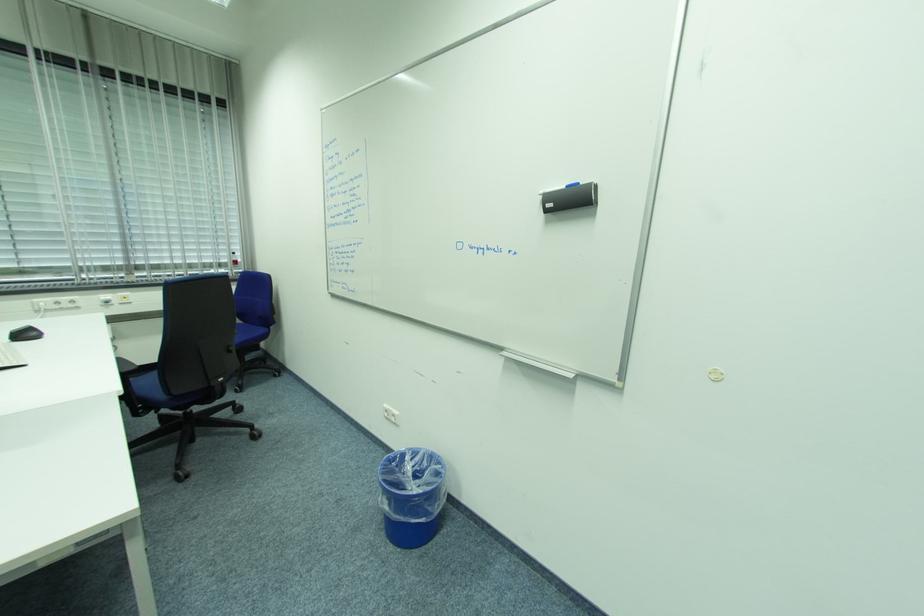
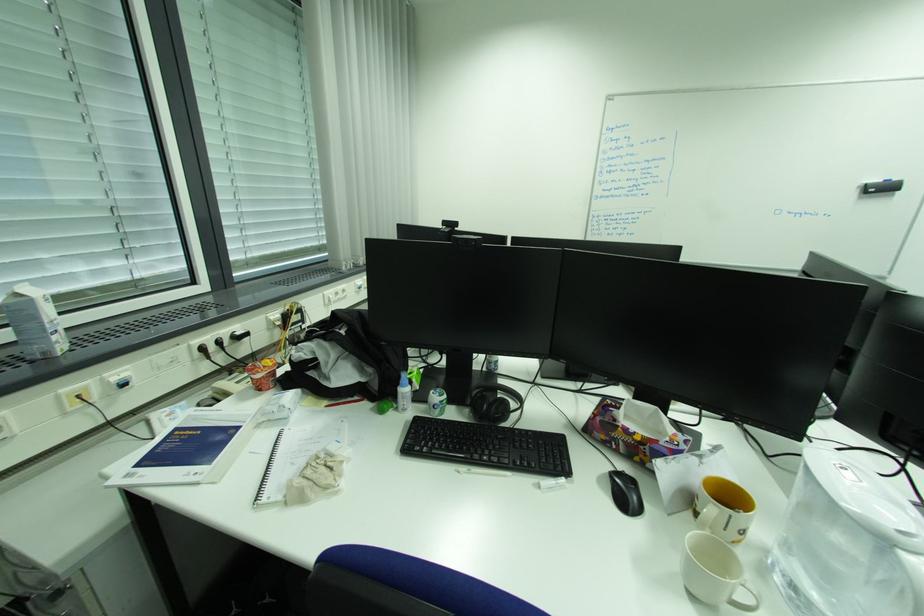
Question: Which direction would the cameraman need to move to produce the second image? Reply with the corresponding letter.

Choices:
 (A) Left
 (B) Right
 (C) Forward
 (D) Backward

Answer: (A)